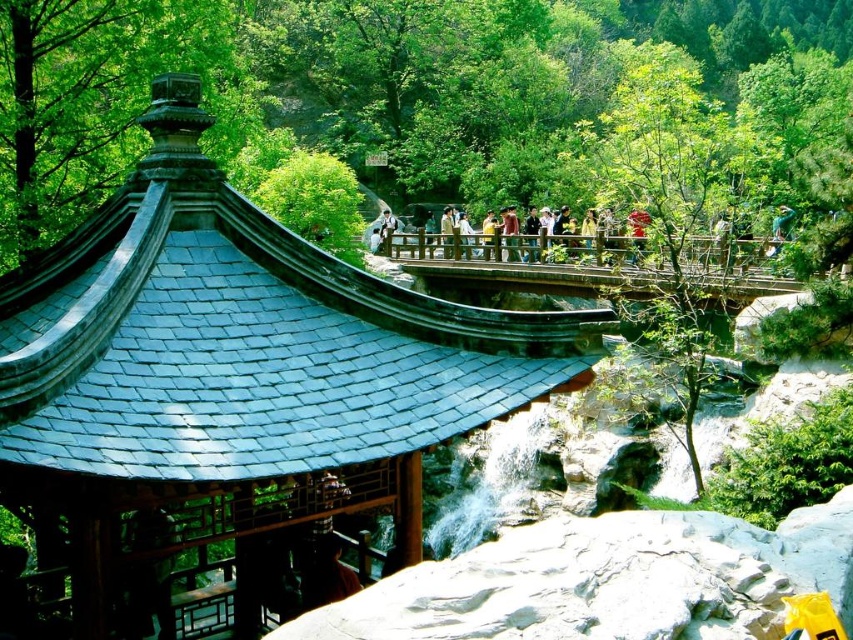
Is brown wooden bridge at center positioned before red fabric person at center?

Yes.

Describe the element at coordinates (521, 268) in the screenshot. The image size is (853, 640). I see `brown wooden bridge at center` at that location.

Which is in front, point (631, 268) or point (634, 252)?

Point (631, 268) is more forward.

What are the coordinates of `brown wooden bridge at center` in the screenshot? It's located at (521, 268).

Is shiny dark blue roof at center smaller than brown wooden bridge at center?

Indeed, shiny dark blue roof at center has a smaller size compared to brown wooden bridge at center.

Between shiny dark blue roof at center and brown wooden bridge at center, which one appears on the right side from the viewer's perspective?

From the viewer's perspective, brown wooden bridge at center appears more on the right side.

Is point (149, 198) less distant than point (492, 273)?

Yes, point (149, 198) is in front of point (492, 273).

The height and width of the screenshot is (640, 853). I want to click on shiny dark blue roof at center, so click(236, 372).

Can you confirm if shiny dark blue roof at center is shorter than red fabric person at center?

Yes.

Measure the distance between point [370,410] and camera.

Point [370,410] and camera are 42.66 feet apart from each other.

The image size is (853, 640). What do you see at coordinates (236, 372) in the screenshot? I see `shiny dark blue roof at center` at bounding box center [236, 372].

Image resolution: width=853 pixels, height=640 pixels. In order to click on shiny dark blue roof at center in this screenshot , I will do `click(236, 372)`.